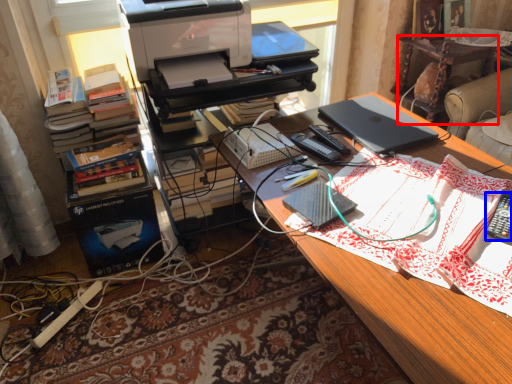
Question: Which object appears farthest to the camera in this image, computer desk (highlighted by a red box) or remote control (highlighted by a blue box)?

Choices:
 (A) computer desk
 (B) remote control

Answer: (A)